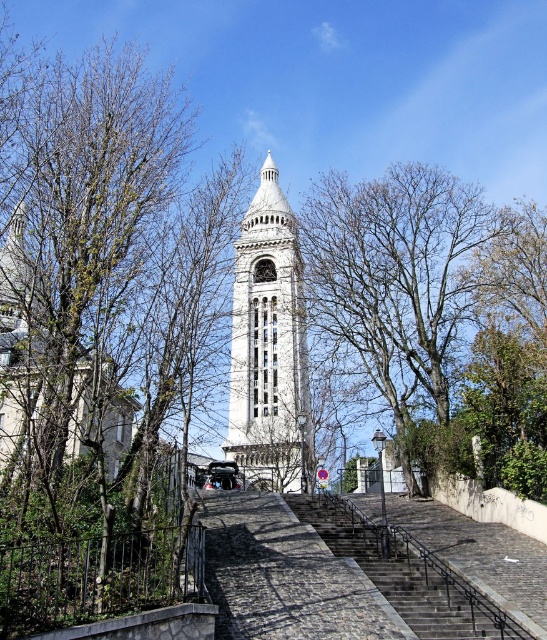
Between green leafy tree at upper left and bare branches at center, which one has less height?

With less height is bare branches at center.

Can you confirm if green leafy tree at upper left is wider than bare branches at center?

Indeed, green leafy tree at upper left has a greater width compared to bare branches at center.

Between point (149, 570) and point (435, 445), which one is positioned in front?

Point (149, 570) is in front.

Where is `green leafy tree at upper left`? This screenshot has height=640, width=547. green leafy tree at upper left is located at coordinates (104, 332).

You are a GUI agent. You are given a task and a screenshot of the screen. Output one action in this format:
    pyautogui.click(x=<x>, y=<y>)
    Task: Click on the bare branches at center
    
    Given the screenshot: What is the action you would take?
    pyautogui.click(x=438, y=314)

Looking at this image, who is positioned more to the left, bare branches at center or white stone clock tower at center?

white stone clock tower at center is more to the left.

Between point (445, 348) and point (265, 456), which one is positioned in front?

Positioned in front is point (265, 456).

Where is `bare branches at center`? bare branches at center is located at coordinates (438, 314).

Consider the image. Who is more forward, (152,490) or (451,605)?

Positioned in front is point (451,605).

Is green leafy tree at upper left to the left of dark gray stone stairs at center from the viewer's perspective?

Correct, you'll find green leafy tree at upper left to the left of dark gray stone stairs at center.

Image resolution: width=547 pixels, height=640 pixels. Find the location of `green leafy tree at upper left`. green leafy tree at upper left is located at coordinates (104, 332).

Find the location of a particular element. green leafy tree at upper left is located at coordinates (104, 332).